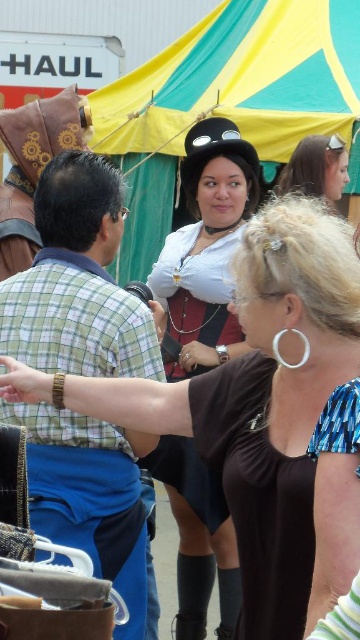
Question: Observing the image, what is the correct spatial positioning of matte white blouse at center in reference to matte black hat at upper center?

Choices:
 (A) above
 (B) below

Answer: (B)

Question: Which of the following is the farthest from the observer?

Choices:
 (A) matte black hat at upper center
 (B) matte white blouse at center
 (C) green plaid shirt at left
 (D) matte black hat at center

Answer: (A)

Question: Among these objects, which one is nearest to the camera?

Choices:
 (A) matte white blouse at center
 (B) matte black hat at upper center

Answer: (A)

Question: Considering the relative positions of matte white blouse at center and green plaid shirt at left in the image provided, where is matte white blouse at center located with respect to green plaid shirt at left?

Choices:
 (A) below
 (B) above

Answer: (A)

Question: Among these points, which one is farthest from the camera?

Choices:
 (A) (200, 372)
 (B) (324, 145)

Answer: (B)

Question: Is the position of matte black hat at center more distant than that of matte black hat at upper center?

Choices:
 (A) yes
 (B) no

Answer: (B)